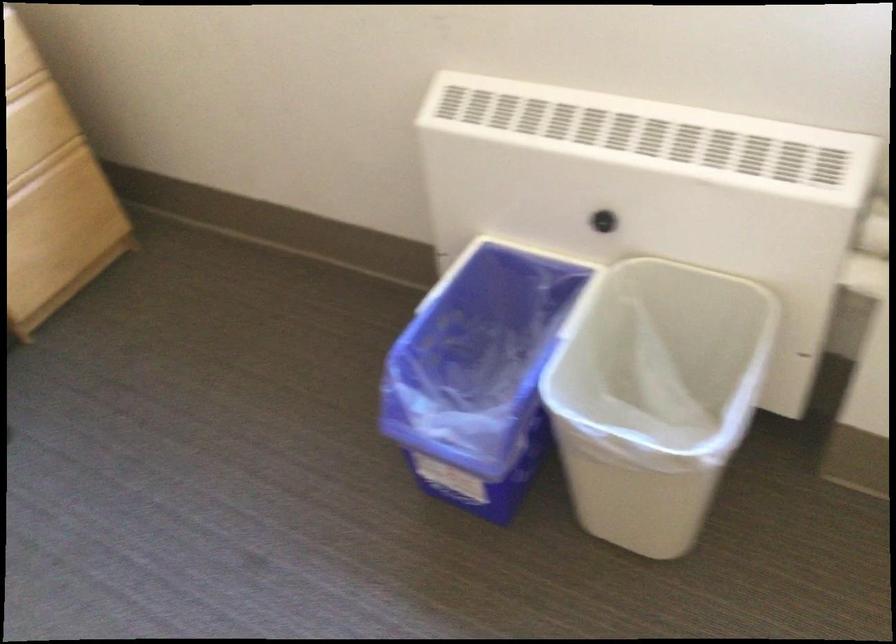
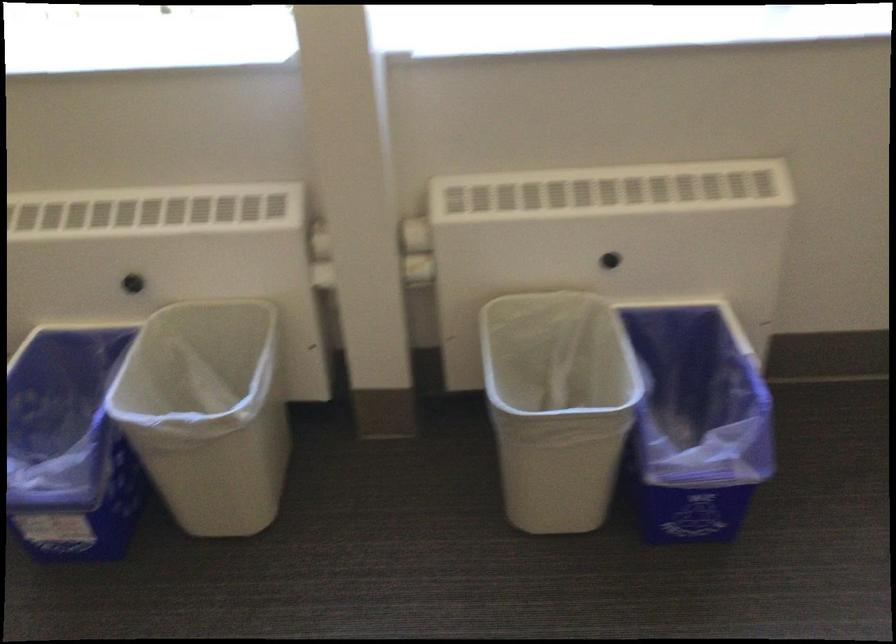
Where in the second image is the point corresponding to pixel 606 222 from the first image?

(132, 283)